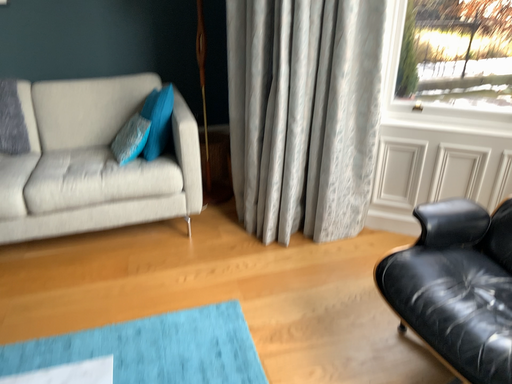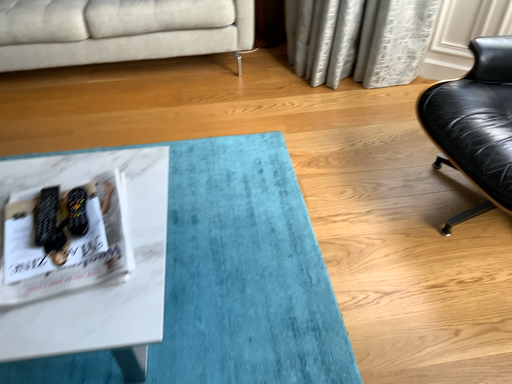
Question: Which way did the camera rotate in the video?

Choices:
 (A) rotated upward
 (B) rotated downward

Answer: (B)